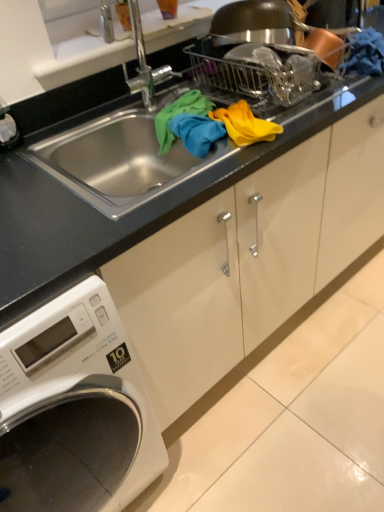
The image size is (384, 512). What are the coordinates of `vacant area on top of yellow fabric at upper center (from a real-world perspective)` in the screenshot? It's located at (244, 119).